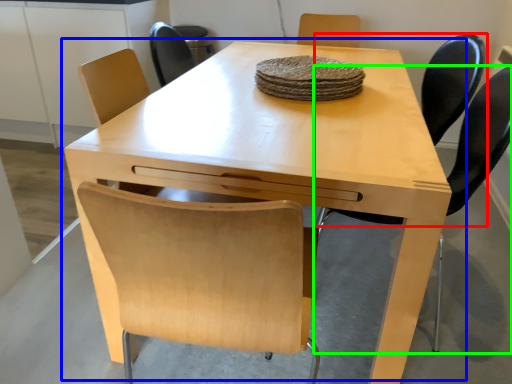
Question: Which object is the closest to the chair (highlighted by a red box)? Choose among these: table (highlighted by a blue box) or chair (highlighted by a green box).

Choices:
 (A) table
 (B) chair

Answer: (B)